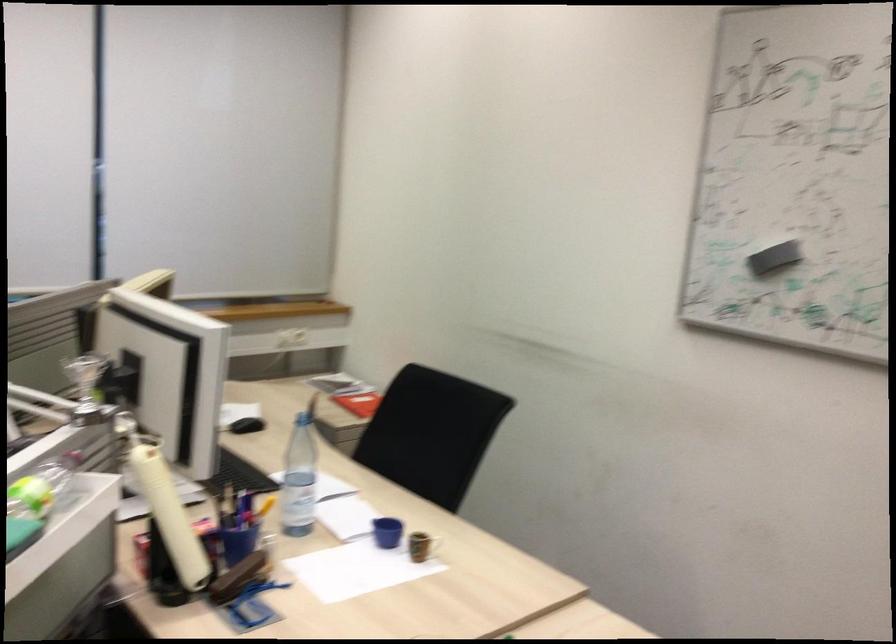
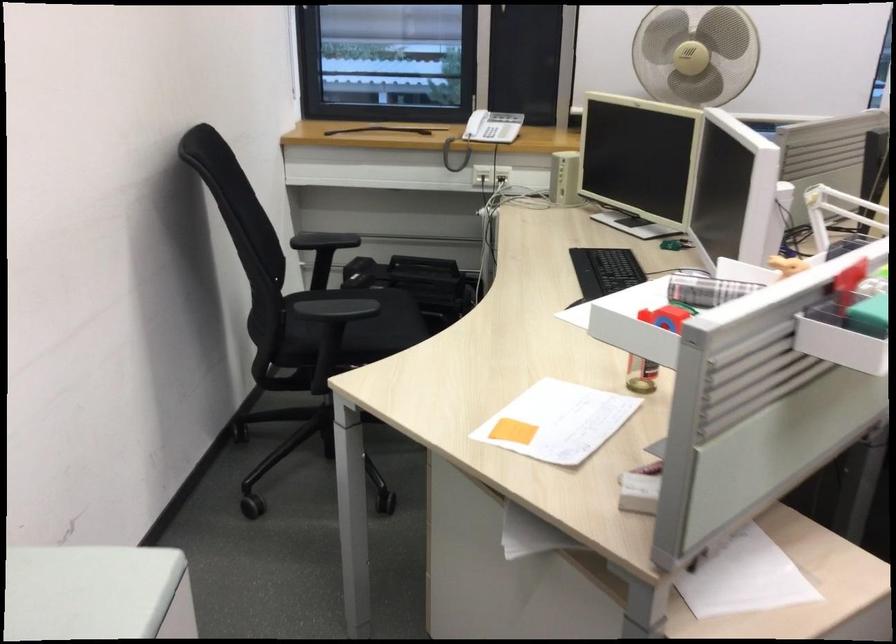
Question: Based on the continuous images, in which direction is the camera rotating? Reply with the corresponding letter.

Choices:
 (A) Left
 (B) Right
 (C) Up
 (D) Down

Answer: (A)